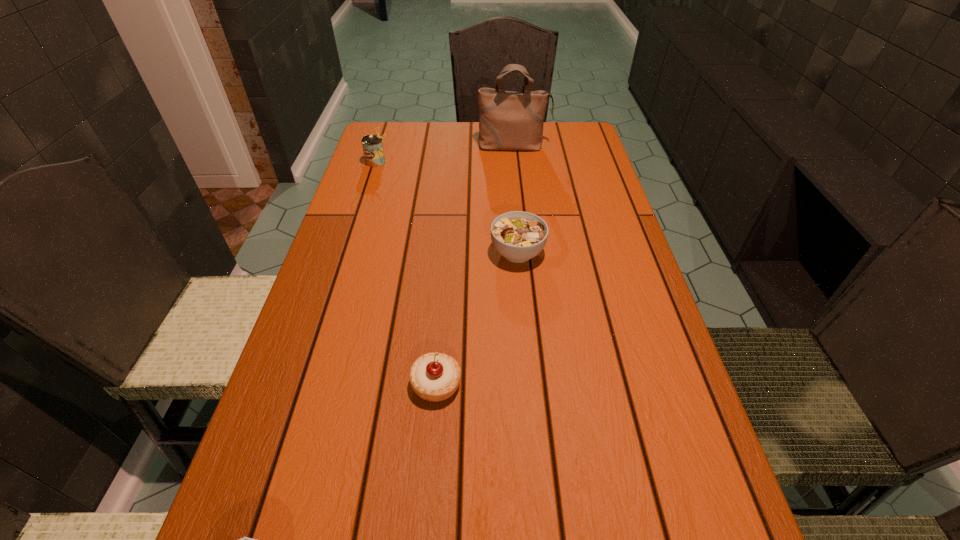
At what (x,y) coordinates should I click in order to perform the action: click on the farthest object. Please return your answer as a coordinate pair (x, y). Looking at the image, I should click on (508, 120).

The height and width of the screenshot is (540, 960). I want to click on shoulder bag, so click(x=508, y=120).

Locate an element on the screen. the fourth nearest object is located at coordinates (372, 145).

Where is `the second tallest object`? The image size is (960, 540). the second tallest object is located at coordinates (372, 145).

Find the location of a particular element. the third farthest object is located at coordinates (519, 236).

Where is `the taller soup bowl`? Image resolution: width=960 pixels, height=540 pixels. the taller soup bowl is located at coordinates (519, 236).

This screenshot has width=960, height=540. I want to click on pastry, so click(x=434, y=377).

The height and width of the screenshot is (540, 960). In order to click on the third object from right to left in this screenshot , I will do `click(434, 377)`.

The height and width of the screenshot is (540, 960). Find the location of `vacant region located on the front-facing side of the shoulder bag`. vacant region located on the front-facing side of the shoulder bag is located at coordinates (521, 216).

Find the location of `vacant area situated 0.270m on the right of the fourth nearest object`. vacant area situated 0.270m on the right of the fourth nearest object is located at coordinates (478, 162).